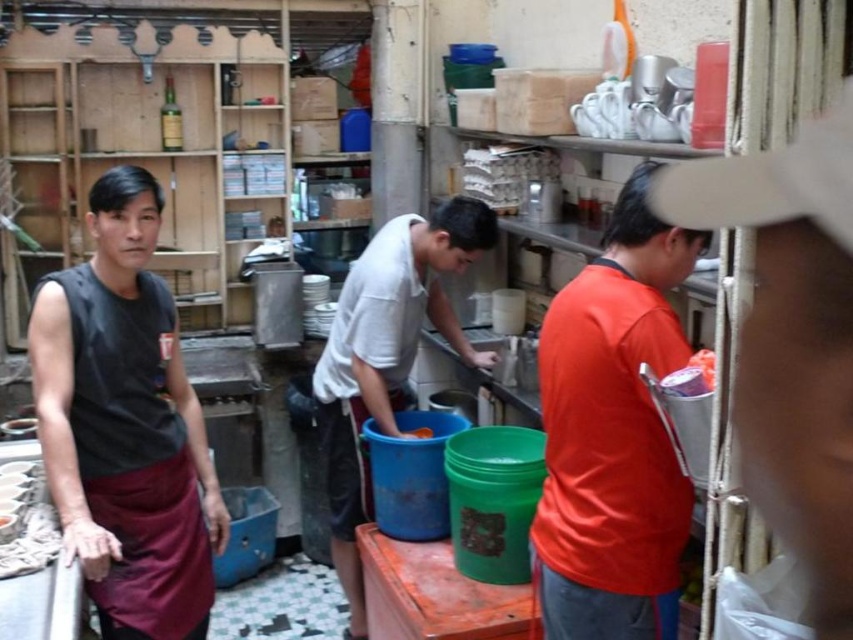
How far apart are white matte shirt at center and blue plastic bucket at center?

The distance of white matte shirt at center from blue plastic bucket at center is 42.67 centimeters.

Is point (415, 221) behind point (428, 429)?

No, (415, 221) is in front of (428, 429).

Where is `white matte shirt at center`? white matte shirt at center is located at coordinates (386, 356).

Is orange matte shirt at right to the right of white matte shirt at center from the viewer's perspective?

Yes, orange matte shirt at right is to the right of white matte shirt at center.

Which is above, orange matte shirt at right or white matte shirt at center?

orange matte shirt at right

Is point (619, 576) positioned before point (384, 237)?

Yes, point (619, 576) is in front of point (384, 237).

This screenshot has width=853, height=640. Identify the location of orange matte shirt at right. click(x=613, y=435).

Is black sleeveless shirt at left bigger than white matte shirt at center?

Actually, black sleeveless shirt at left might be smaller than white matte shirt at center.

The width and height of the screenshot is (853, 640). Describe the element at coordinates (125, 426) in the screenshot. I see `black sleeveless shirt at left` at that location.

Find the location of a particular element. The width and height of the screenshot is (853, 640). black sleeveless shirt at left is located at coordinates (125, 426).